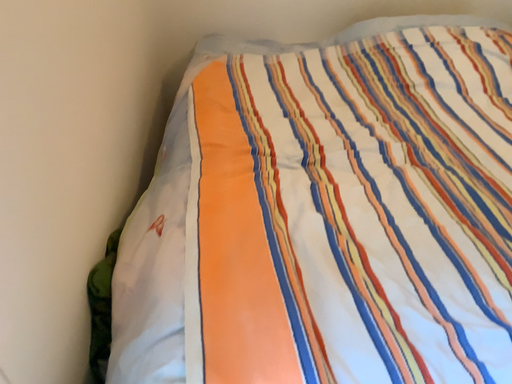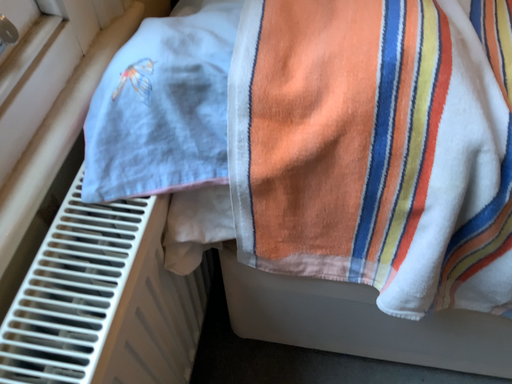
Question: How did the camera likely rotate when shooting the video?

Choices:
 (A) rotated upward
 (B) rotated downward

Answer: (B)